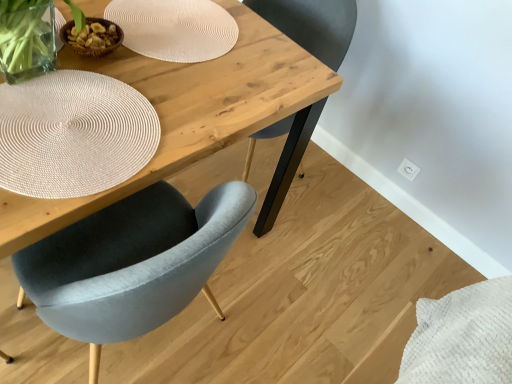
Question: Is the depth of white woven placemat at upper left, which ranks as the 1th paper plate in front-to-back order, greater than that of velvet grey chair at center?

Choices:
 (A) no
 (B) yes

Answer: (A)

Question: Is white woven placemat at upper left, which ranks as the 1th paper plate in front-to-back order, to the left of velvet grey chair at center from the viewer's perspective?

Choices:
 (A) no
 (B) yes

Answer: (B)

Question: Is white woven placemat at upper left, which ranks as the 1th paper plate in front-to-back order, positioned in front of velvet grey chair at center?

Choices:
 (A) yes
 (B) no

Answer: (A)

Question: Is velvet grey chair at center inside white woven placemat at upper left, arranged as the second paper plate when viewed from the top?

Choices:
 (A) yes
 (B) no

Answer: (B)

Question: Is white woven placemat at upper left, acting as the 1th paper plate starting from the bottom, smaller than velvet grey chair at center?

Choices:
 (A) no
 (B) yes

Answer: (B)

Question: From the image's perspective, is natural wood table at center above or below velvet grey chair at center?

Choices:
 (A) above
 (B) below

Answer: (B)

Question: Considering their positions, is natural wood table at center located in front of or behind velvet grey chair at center?

Choices:
 (A) front
 (B) behind

Answer: (A)

Question: Considering the relative positions of natural wood table at center and velvet grey chair at center in the image provided, is natural wood table at center to the left or to the right of velvet grey chair at center?

Choices:
 (A) right
 (B) left

Answer: (B)

Question: From a real-world perspective, is natural wood table at center physically located above or below velvet grey chair at center?

Choices:
 (A) below
 (B) above

Answer: (A)

Question: Is natural wood table at center wider or thinner than white woven placemat at upper left, which ranks as the 2th paper plate in back-to-front order?

Choices:
 (A) thin
 (B) wide

Answer: (B)

Question: Does point (244, 36) appear closer or farther from the camera than point (16, 104)?

Choices:
 (A) closer
 (B) farther

Answer: (B)

Question: From a real-world perspective, is natural wood table at center physically located above or below white woven placemat at upper left, acting as the 1th paper plate starting from the bottom?

Choices:
 (A) above
 (B) below

Answer: (B)

Question: Is natural wood table at center taller or shorter than white woven placemat at upper left, which ranks as the 1th paper plate in front-to-back order?

Choices:
 (A) short
 (B) tall

Answer: (B)

Question: In terms of height, does white textured placemat at upper center, which is counted as the first paper plate, starting from the back, look taller or shorter compared to white woven placemat at upper left, which ranks as the 2th paper plate in back-to-front order?

Choices:
 (A) short
 (B) tall

Answer: (B)

Question: Considering the positions of point (176, 23) and point (25, 145), is point (176, 23) closer or farther from the camera than point (25, 145)?

Choices:
 (A) farther
 (B) closer

Answer: (A)